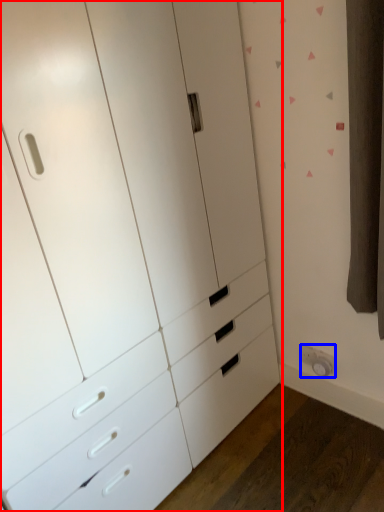
Question: Which of the following is the closest to the observer, chest of drawers (highlighted by a red box) or electric outlet (highlighted by a blue box)?

Choices:
 (A) chest of drawers
 (B) electric outlet

Answer: (A)